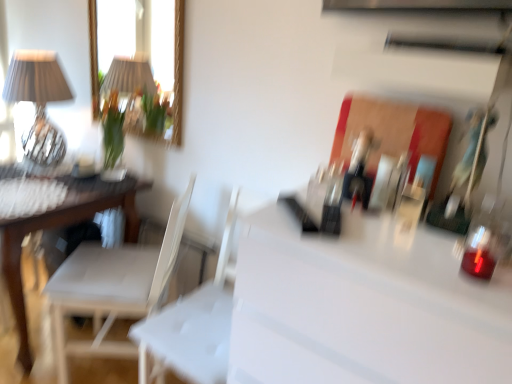
You are a GUI agent. You are given a task and a screenshot of the screen. Output one action in this format:
    pyautogui.click(x=<x>, y=<y>)
    Task: Click on the white glossy counter top at center
    
    Given the screenshot: What is the action you would take?
    pyautogui.click(x=362, y=306)

Measure the distance between point (109,343) and camera.

A: A distance of 6.22 feet exists between point (109,343) and camera.

Identify the location of white glossy counter top at center. (362, 306).

Considering the relative positions of white glossy counter top at center and matte glass table lamp at upper left in the image provided, is white glossy counter top at center to the left or to the right of matte glass table lamp at upper left?

white glossy counter top at center is to the right of matte glass table lamp at upper left.

Is point (399, 375) farther from camera compared to point (26, 78)?

No, (399, 375) is closer to viewer.

Locate an element on the screen. The height and width of the screenshot is (384, 512). counter top directly beneath the matte glass table lamp at upper left (from a real-world perspective) is located at coordinates (362, 306).

In the scene shown: From a real-world perspective, which object rests below the other?

white glossy counter top at center.

Considering the positions of point (139, 292) and point (283, 311), is point (139, 292) closer or farther from the camera than point (283, 311)?

Clearly, point (139, 292) is more distant from the camera than point (283, 311).

Considering the sizes of objects white fabric chair at left and white glossy counter top at center in the image provided, who is thinner, white fabric chair at left or white glossy counter top at center?

With smaller width is white fabric chair at left.

Between white fabric chair at left and white glossy counter top at center, which one has smaller size?

Smaller between the two is white fabric chair at left.

In the image, is white fabric chair at left positioned in front of or behind white glossy counter top at center?

Visually, white fabric chair at left is located behind white glossy counter top at center.

Is the position of matte glass table lamp at upper left less distant than that of white glossy counter top at center?

No.

Is matte glass table lamp at upper left inside the boundaries of white glossy counter top at center, or outside?

matte glass table lamp at upper left is outside white glossy counter top at center.

From a real-world perspective, is matte glass table lamp at upper left located beneath white glossy counter top at center?

No, from a real-world perspective, matte glass table lamp at upper left is not beneath white glossy counter top at center.

From the image's perspective, which is below, matte glass table lamp at upper left or white plastic swivel chair at center?

white plastic swivel chair at center.

Based on their positions, is matte glass table lamp at upper left located to the left or right of white plastic swivel chair at center?

Answer: Based on their positions, matte glass table lamp at upper left is located to the left of white plastic swivel chair at center.

Is matte glass table lamp at upper left not within white plastic swivel chair at center?

Yes.

Visually, is white glossy counter top at center positioned to the left or to the right of white plastic swivel chair at center?

From the image, it's evident that white glossy counter top at center is to the right of white plastic swivel chair at center.

Consider the image. Who is taller, white glossy counter top at center or white plastic swivel chair at center?

white glossy counter top at center is taller.

Considering the relative sizes of white glossy counter top at center and white plastic swivel chair at center in the image provided, is white glossy counter top at center thinner than white plastic swivel chair at center?

Incorrect, the width of white glossy counter top at center is not less than that of white plastic swivel chair at center.

From a real-world perspective, which is physically below, white glossy counter top at center or white plastic swivel chair at center?

white plastic swivel chair at center is physically lower.

Is white glossy counter top at center beside white fabric chair at left?

No, white glossy counter top at center is not beside white fabric chair at left.

Where is `counter top located below the white fabric chair at left (from the image's perspective)`? counter top located below the white fabric chair at left (from the image's perspective) is located at coordinates (362, 306).

Is white glossy counter top at center not inside white fabric chair at left?

Yes, white glossy counter top at center is not within white fabric chair at left.

Based on the photo, considering the sizes of objects white glossy counter top at center and white fabric chair at left in the image provided, who is shorter, white glossy counter top at center or white fabric chair at left?

white fabric chair at left is shorter.

Considering the sizes of objects white fabric chair at left and white plastic swivel chair at center in the image provided, who is wider, white fabric chair at left or white plastic swivel chair at center?

white fabric chair at left.

Is white fabric chair at left not close to white plastic swivel chair at center?

No, there isn't a large distance between white fabric chair at left and white plastic swivel chair at center.

Locate an element on the screen. This screenshot has width=512, height=384. chair above the white plastic swivel chair at center (from the image's perspective) is located at coordinates tap(114, 286).

Which is farther from the camera, (70, 270) or (203, 316)?

Positioned behind is point (70, 270).

You are a GUI agent. You are given a task and a screenshot of the screen. Output one action in this format:
    pyautogui.click(x=<x>, y=<y>)
    Task: Click on the counter top located in front of the matte glass table lamp at upper left
    The width and height of the screenshot is (512, 384).
    Given the screenshot: What is the action you would take?
    pyautogui.click(x=362, y=306)

The width and height of the screenshot is (512, 384). In order to click on counter top below the white fabric chair at left (from the image's perspective) in this screenshot , I will do `click(362, 306)`.

Estimate the real-world distances between objects in this image. Which object is further from white fabric chair at left, white glossy counter top at center or matte glass table lamp at upper left?

Based on the image, white glossy counter top at center appears to be further to white fabric chair at left.

From the image, which object appears to be nearer to white fabric chair at left, white plastic swivel chair at center or matte glass table lamp at upper left?

Based on the image, white plastic swivel chair at center appears to be nearer to white fabric chair at left.

Considering their positions, is white glossy counter top at center positioned further to matte glass table lamp at upper left than white fabric chair at left?

Among the two, white glossy counter top at center is located further to matte glass table lamp at upper left.

Considering their positions, is white plastic swivel chair at center positioned closer to matte glass table lamp at upper left than white glossy counter top at center?

The object closer to matte glass table lamp at upper left is white plastic swivel chair at center.

When comparing their distances from white fabric chair at left, does matte glass table lamp at upper left or white glossy counter top at center seem further?

Based on the image, white glossy counter top at center appears to be further to white fabric chair at left.

Which object lies further to the anchor point white plastic swivel chair at center, white fabric chair at left or white glossy counter top at center?

white glossy counter top at center is further to white plastic swivel chair at center.

Considering their positions, is white fabric chair at left positioned further to white glossy counter top at center than white plastic swivel chair at center?

white fabric chair at left is positioned further to the anchor white glossy counter top at center.

When comparing their distances from matte glass table lamp at upper left, does white fabric chair at left or white glossy counter top at center seem closer?

white fabric chair at left is closer to matte glass table lamp at upper left.

This screenshot has height=384, width=512. I want to click on chair between matte glass table lamp at upper left and white glossy counter top at center from left to right, so click(114, 286).

This screenshot has width=512, height=384. I want to click on swivel chair between white fabric chair at left and white glossy counter top at center from left to right, so click(193, 325).

Locate an element on the screen. Image resolution: width=512 pixels, height=384 pixels. chair between matte glass table lamp at upper left and white plastic swivel chair at center vertically is located at coordinates (114, 286).

Where is `swivel chair between matte glass table lamp at upper left and white glossy counter top at center from left to right`? The height and width of the screenshot is (384, 512). swivel chair between matte glass table lamp at upper left and white glossy counter top at center from left to right is located at coordinates (193, 325).